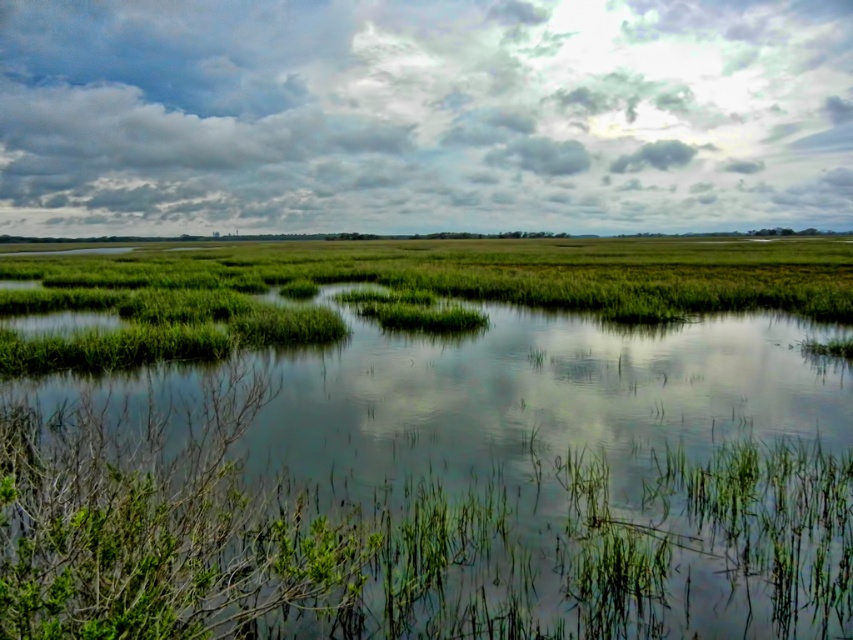
Question: Does cloudy sky at upper center lie in front of green grassy water at center?

Choices:
 (A) no
 (B) yes

Answer: (A)

Question: Can you confirm if cloudy sky at upper center is positioned below green grassy water at center?

Choices:
 (A) yes
 (B) no

Answer: (B)

Question: Which point is farther to the camera?

Choices:
 (A) green grassy water at center
 (B) cloudy sky at upper center

Answer: (B)

Question: Among these objects, which one is nearest to the camera?

Choices:
 (A) cloudy sky at upper center
 (B) green grassy water at center

Answer: (B)

Question: Is cloudy sky at upper center to the left of green grassy water at center from the viewer's perspective?

Choices:
 (A) yes
 (B) no

Answer: (A)

Question: Which point is closer to the camera?

Choices:
 (A) (486, 326)
 (B) (103, 81)

Answer: (A)